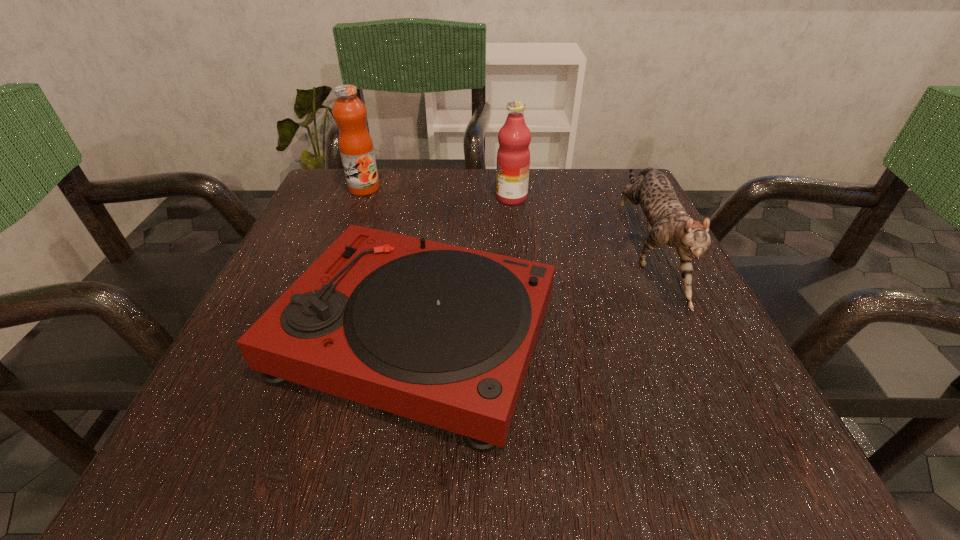
At what (x,y) coordinates should I click in order to perform the action: click on vacant region that satisfies the following two spatial constraints: 1. on the front label of the left fruit juice; 2. on the left side of the record player. Please return your answer as a coordinate pair (x, y). Looking at the image, I should click on (307, 335).

Identify the location of free space that satisfies the following two spatial constraints: 1. on the label of the right fruit juice; 2. on the front side of the record player. (525, 335).

Find the location of `free space in the image that satisfies the following two spatial constraints: 1. on the front label of the record player; 2. on the right side of the left fruit juice`. free space in the image that satisfies the following two spatial constraints: 1. on the front label of the record player; 2. on the right side of the left fruit juice is located at coordinates (307, 335).

The image size is (960, 540). What are the coordinates of `vacant space that satisfies the following two spatial constraints: 1. on the label of the right fruit juice; 2. on the front side of the shortest object` in the screenshot? It's located at (525, 335).